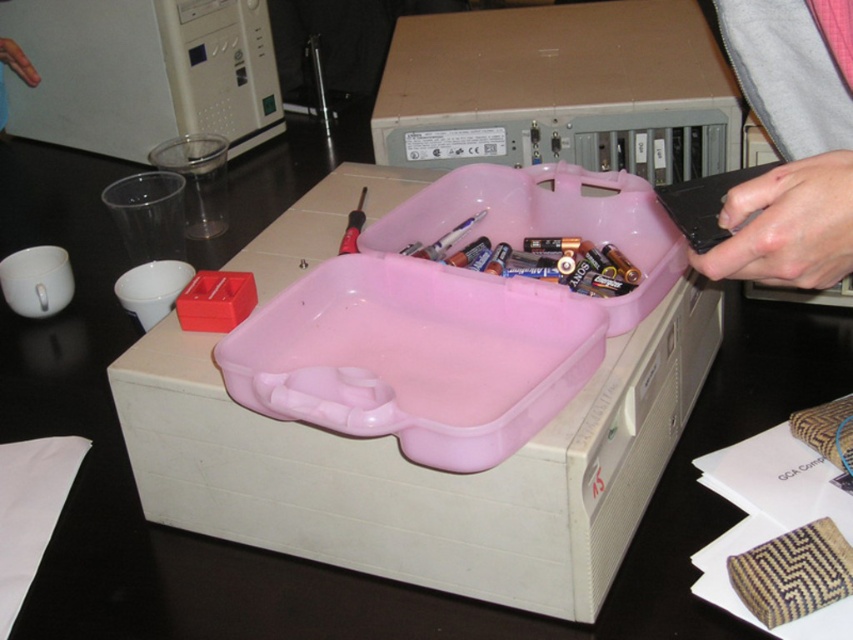
Question: Among these points, which one is farthest from the camera?

Choices:
 (A) (729, 211)
 (B) (671, 161)

Answer: (B)

Question: Does matte cardboard box at center appear under gray fabric sleeve at upper right?

Choices:
 (A) no
 (B) yes

Answer: (A)

Question: Which of the following is the farthest from the observer?

Choices:
 (A) (466, 113)
 (B) (782, 166)

Answer: (A)

Question: Considering the relative positions of matte cardboard box at center and gray fabric sleeve at upper right in the image provided, where is matte cardboard box at center located with respect to gray fabric sleeve at upper right?

Choices:
 (A) left
 (B) right

Answer: (A)

Question: Can you confirm if matte cardboard box at center is bigger than gray fabric sleeve at upper right?

Choices:
 (A) no
 (B) yes

Answer: (B)